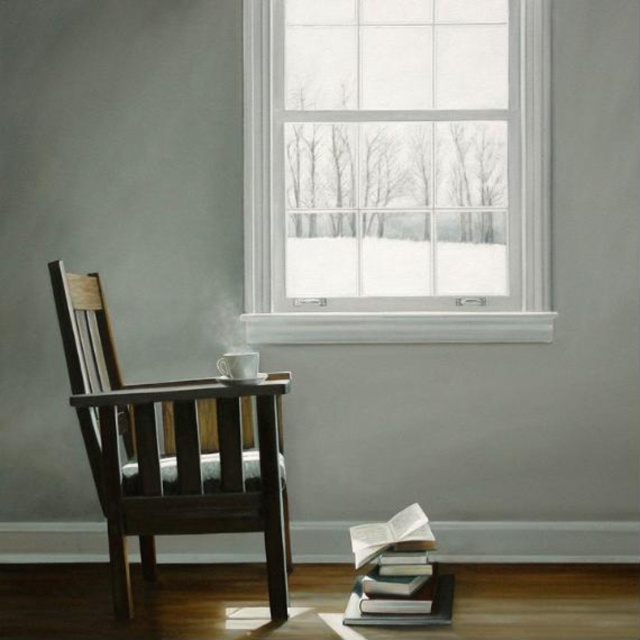
Question: Does white glass window at upper center appear over hardcover books at lower right?

Choices:
 (A) no
 (B) yes

Answer: (B)

Question: Is white glass window at upper center above dark wood armchair at left?

Choices:
 (A) yes
 (B) no

Answer: (A)

Question: Is dark wood armchair at left thinner than hardcover books at lower right?

Choices:
 (A) yes
 (B) no

Answer: (B)

Question: Among these objects, which one is nearest to the camera?

Choices:
 (A) dark wood armchair at left
 (B) hardcover books at lower right

Answer: (A)

Question: Which object appears farthest from the camera in this image?

Choices:
 (A) dark wood armchair at left
 (B) hardcover books at lower right

Answer: (B)

Question: Which object is closer to the camera taking this photo?

Choices:
 (A) dark wood armchair at left
 (B) white glass window at upper center
 (C) hardcover books at lower right

Answer: (A)